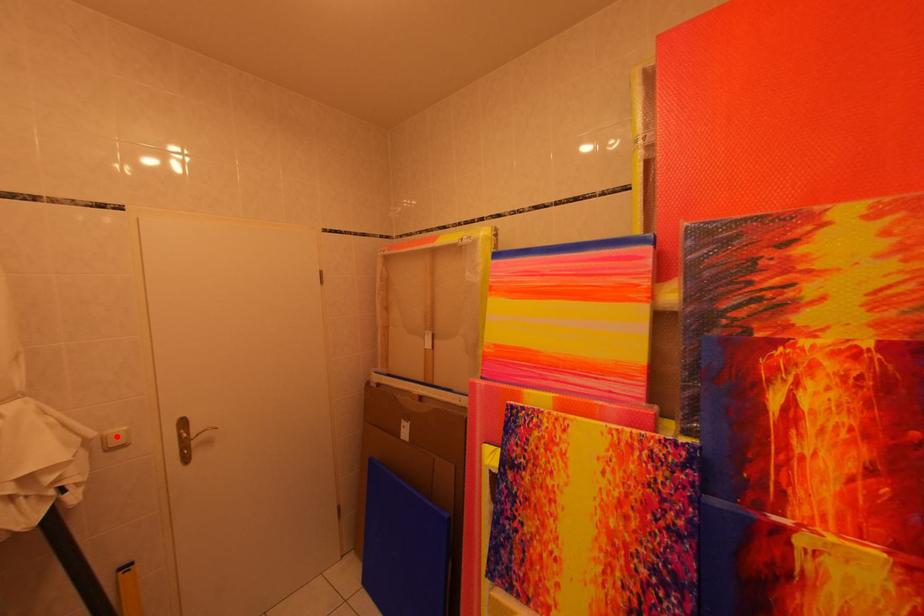
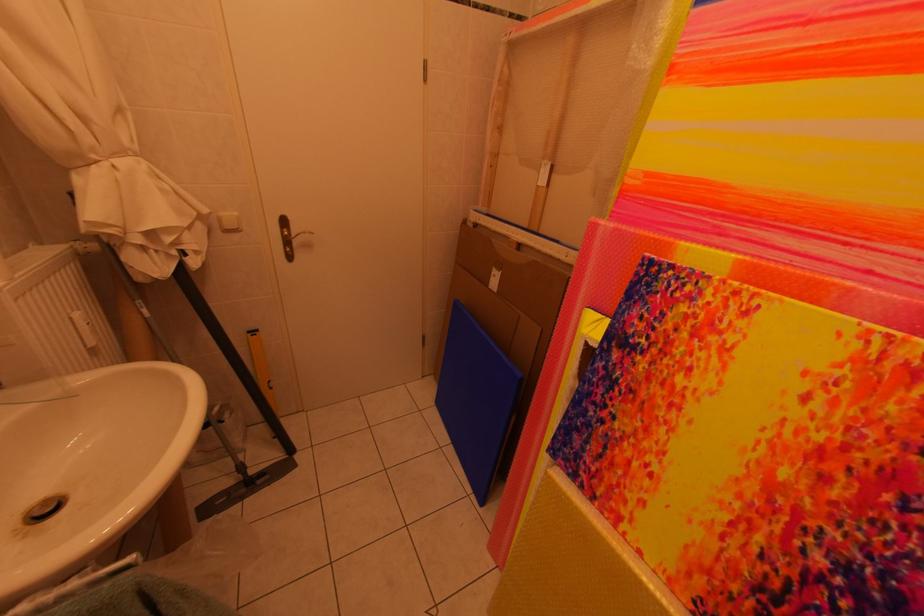
Locate, in the second image, the point that corresponds to the highlighted location in the first image.

(229, 217)